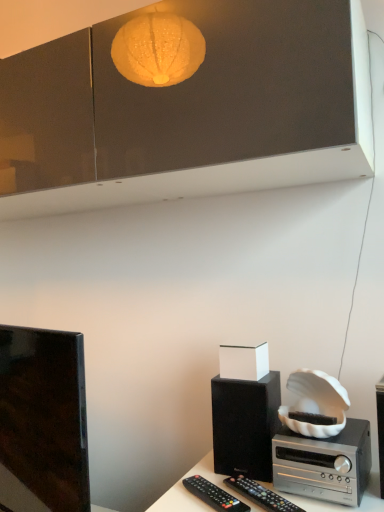
Question: Considering the relative sizes of black matte speaker at lower right and black plastic remote control at lower center, the 1th remote control in the left-to-right sequence, in the image provided, is black matte speaker at lower right thinner than black plastic remote control at lower center, the 1th remote control in the left-to-right sequence,?

Choices:
 (A) no
 (B) yes

Answer: (A)

Question: From the image's perspective, is black matte speaker at lower right on black plastic remote control at lower center, the 1th remote control in the left-to-right sequence?

Choices:
 (A) yes
 (B) no

Answer: (A)

Question: Considering the relative positions of black matte speaker at lower right and black plastic remote control at lower center, the 1th remote control in the left-to-right sequence, in the image provided, is black matte speaker at lower right in front of black plastic remote control at lower center, the 1th remote control in the left-to-right sequence,?

Choices:
 (A) no
 (B) yes

Answer: (A)

Question: Is black matte speaker at lower right looking in the opposite direction of black plastic remote control at lower center, the 1th remote control in the left-to-right sequence?

Choices:
 (A) yes
 (B) no

Answer: (B)

Question: Can you confirm if black matte speaker at lower right is positioned to the left of black plastic remote control at lower center, the 1th remote control in the left-to-right sequence?

Choices:
 (A) yes
 (B) no

Answer: (B)

Question: From a real-world perspective, is silver metallic stereo at lower right above or below black plastic remote control at lower center, positioned as the 2th remote control in right-to-left order?

Choices:
 (A) below
 (B) above

Answer: (B)

Question: Is silver metallic stereo at lower right bigger or smaller than black plastic remote control at lower center, positioned as the 2th remote control in right-to-left order?

Choices:
 (A) big
 (B) small

Answer: (A)

Question: Is silver metallic stereo at lower right situated inside black plastic remote control at lower center, the 1th remote control in the left-to-right sequence, or outside?

Choices:
 (A) outside
 (B) inside

Answer: (A)

Question: In terms of width, does silver metallic stereo at lower right look wider or thinner when compared to black plastic remote control at lower center, the 1th remote control in the left-to-right sequence?

Choices:
 (A) thin
 (B) wide

Answer: (B)

Question: Based on their sizes in the image, would you say black plastic remote at lower right, the 2th remote control in the left-to-right sequence, is bigger or smaller than silver metallic stereo at lower right?

Choices:
 (A) big
 (B) small

Answer: (B)

Question: Does point (268, 494) appear closer or farther from the camera than point (342, 458)?

Choices:
 (A) closer
 (B) farther

Answer: (B)

Question: From the image's perspective, is black plastic remote at lower right, the 2th remote control in the left-to-right sequence, above or below silver metallic stereo at lower right?

Choices:
 (A) above
 (B) below

Answer: (B)

Question: Would you say black plastic remote at lower right, the 2th remote control in the left-to-right sequence, is to the left or to the right of silver metallic stereo at lower right in the picture?

Choices:
 (A) right
 (B) left

Answer: (B)

Question: In terms of size, does silver metallic stereo at lower right appear bigger or smaller than black matte speaker at lower right?

Choices:
 (A) big
 (B) small

Answer: (A)

Question: From the image's perspective, is silver metallic stereo at lower right above or below black matte speaker at lower right?

Choices:
 (A) below
 (B) above

Answer: (A)